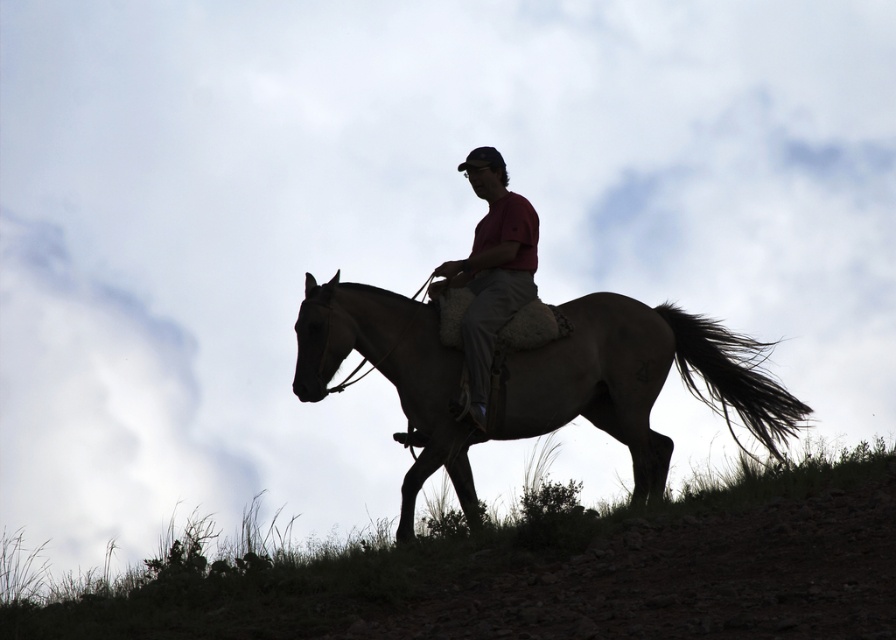
You are a photographer standing at a safe distance from the brown textured horse at center. You want to capture a clear photo of the horse without any distortion. Considering the horse is 11.94 meters away, what is the minimum distance you should maintain to avoid distortion?

The minimum distance you should maintain from the brown textured horse at center is 11.94 meters to avoid distortion, as that is the current distance between the camera and the horse.

You are a hiker who wants to walk through the green grass at lower center to reach the brown textured horse at center. Considering the height of the grass, will you be able to see the horse clearly while walking through the grass?

The green grass at lower center has a lesser height compared to brown textured horse at center, so yes, you will be able to see the horse clearly while walking through the grass.

You are a photographer trying to capture the brown textured horse at center and the green grass at lower center in a single shot. Based on their sizes in the image, which one would you focus on first to ensure clarity?

The green grass at lower center has a smaller size compared to the brown textured horse at center, so you should focus on the brown textured horse at center first since it occupies more of the frame and is larger in the image.